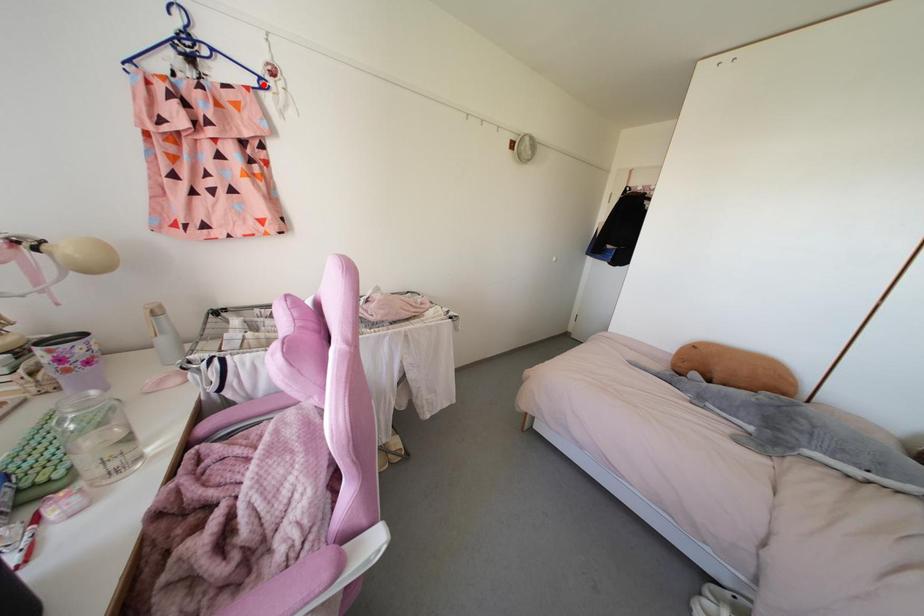
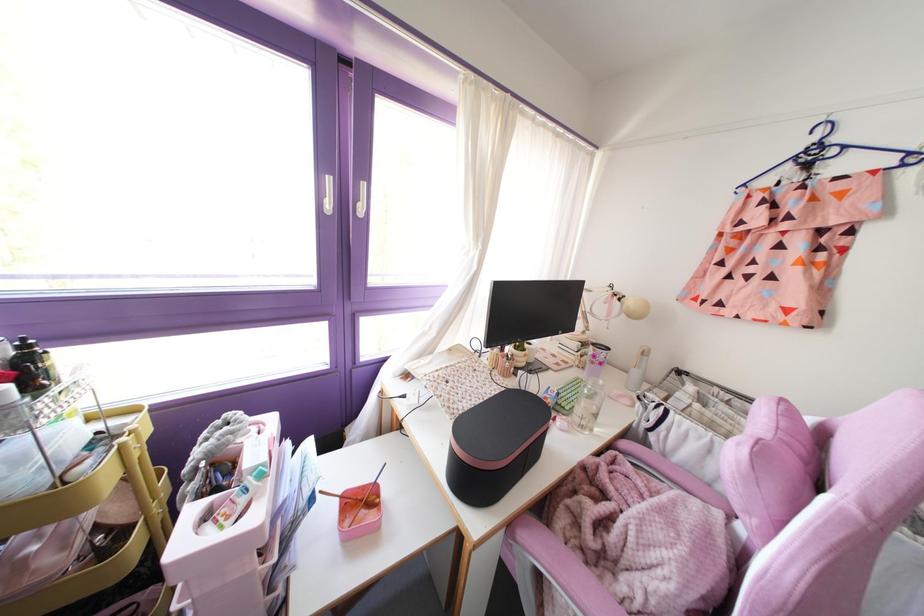
Where in the second image is the point corresponding to the highlighted location from the first image?

(913, 159)